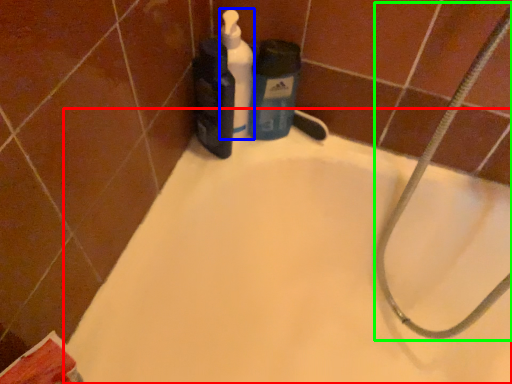
Question: Estimate the real-world distances between objects in this image. Which object is closer to bathtub (highlighted by a red box), cleaning product (highlighted by a blue box) or garden hose (highlighted by a green box)?

Choices:
 (A) cleaning product
 (B) garden hose

Answer: (B)